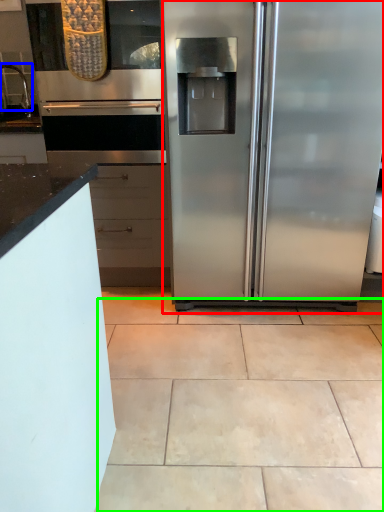
Question: Considering the real-world distances, which object is closest to refrigerator (highlighted by a red box)? faucet (highlighted by a blue box) or ceramic tile (highlighted by a green box).

Choices:
 (A) faucet
 (B) ceramic tile

Answer: (B)